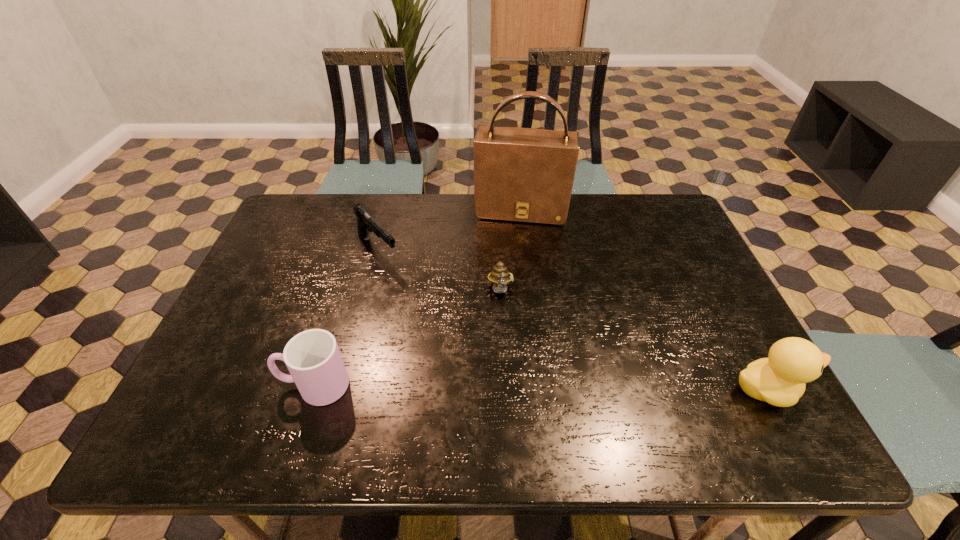
I want to click on vacant area that lies between the shoulder bag and the snail, so click(x=511, y=251).

Image resolution: width=960 pixels, height=540 pixels. Identify the location of free space between the tallest object and the gun. (449, 230).

You are a GUI agent. You are given a task and a screenshot of the screen. Output one action in this format:
    pyautogui.click(x=<x>, y=<y>)
    Task: Click on the free space between the cup and the gun
    
    Given the screenshot: What is the action you would take?
    (346, 318)

Locate an element on the screen. The width and height of the screenshot is (960, 540). free space that is in between the duck and the fourth nearest object is located at coordinates (572, 320).

Image resolution: width=960 pixels, height=540 pixels. I want to click on free space between the farthest object and the gun, so click(449, 230).

Find the location of `free space between the farthest object and the cup`. free space between the farthest object and the cup is located at coordinates (418, 298).

At what (x,y) coordinates should I click in order to perform the action: click on empty space that is in between the third farthest object and the rightmost object. Please return your answer as a coordinate pair (x, y). Looking at the image, I should click on (634, 341).

This screenshot has width=960, height=540. What are the coordinates of `free point between the fourth nearest object and the snail` in the screenshot? It's located at tap(440, 271).

Identify the location of empty space between the shoulder bag and the snail. (511, 251).

At what (x,y) coordinates should I click in order to perform the action: click on unoccupied position between the cup and the gun. Please return your answer as a coordinate pair (x, y). The height and width of the screenshot is (540, 960). Looking at the image, I should click on (346, 318).